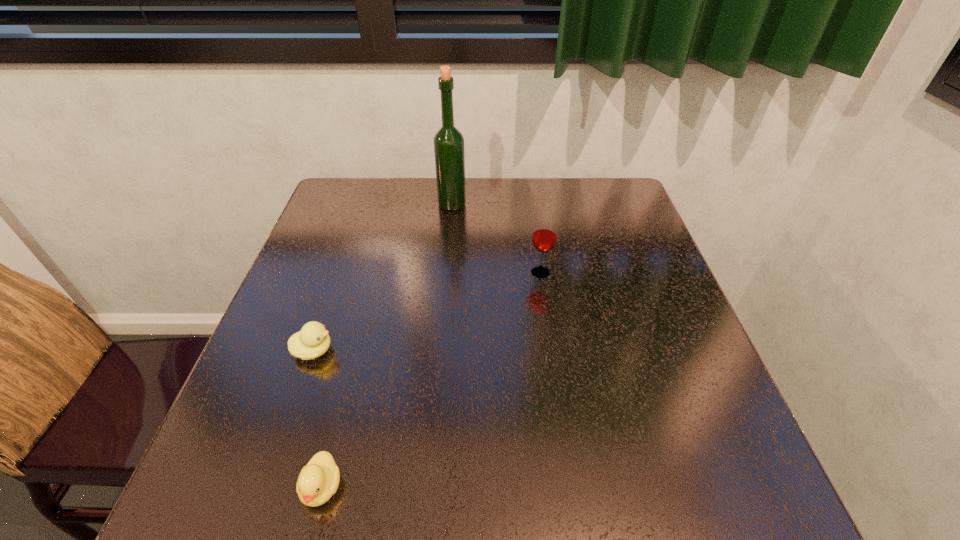
Find the location of `the farthest object`. the farthest object is located at coordinates (449, 152).

Image resolution: width=960 pixels, height=540 pixels. Find the location of `liquor`. liquor is located at coordinates (449, 152).

Where is `the second farthest object`? the second farthest object is located at coordinates coord(544,236).

This screenshot has height=540, width=960. In order to click on the third shortest object in this screenshot , I will do [544, 236].

Locate an element on the screen. Image resolution: width=960 pixels, height=540 pixels. the left duckling is located at coordinates (312, 341).

You are a GUI agent. You are given a task and a screenshot of the screen. Output one action in this format:
    pyautogui.click(x=<x>, y=<y>)
    Task: Click on the second nearest object
    
    Given the screenshot: What is the action you would take?
    pyautogui.click(x=312, y=341)

Where is `the right duckling`? The height and width of the screenshot is (540, 960). the right duckling is located at coordinates (318, 480).

Locate an element on the screen. the nearer duckling is located at coordinates click(x=318, y=480).

This screenshot has width=960, height=540. Identify the location of vacant area located 0.190m on the right of the liquor. (531, 204).

In order to click on free space located on the back of the rightmost object in this screenshot , I will do `click(529, 198)`.